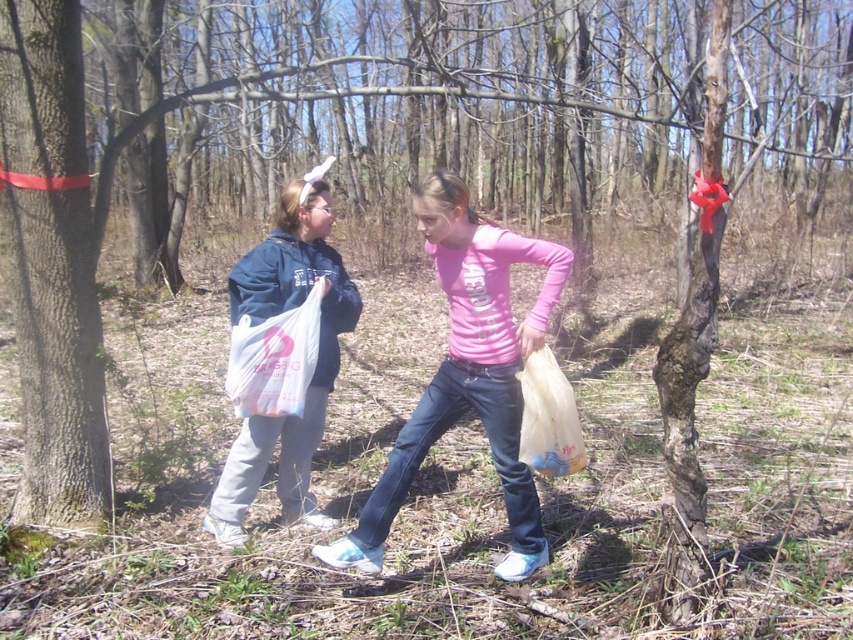
You are planning to place a bench between the smooth bark tree at left and the pink matte shirt at center. Given that the bench requires 5 feet of space, will there be enough room?

The smooth bark tree at left is 4.33 feet from the pink matte shirt at center, which is less than the required 5 feet for the bench. Therefore, there isn not enough space to place the bench between them.